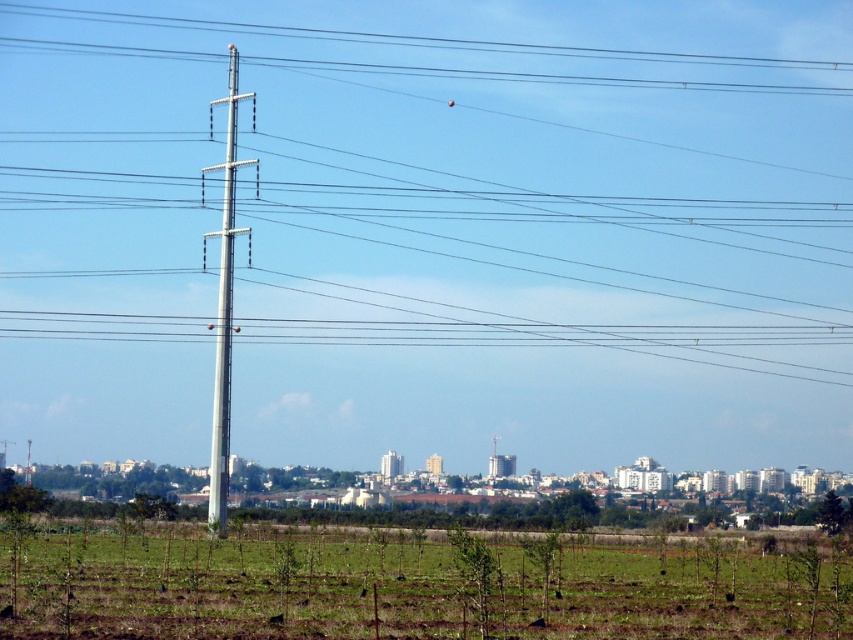
Which is behind, point (521, 620) or point (218, 486)?

Point (218, 486)

Does point (103, 534) lie behind point (219, 467)?

That is True.

Which is in front, point (726, 561) or point (227, 273)?

Positioned in front is point (726, 561).

Where is `green grassy field at lower center`? green grassy field at lower center is located at coordinates (415, 582).

Is metallic wire at center behind metallic gray telegraph pole at left?

Yes, it is.

Does metallic wire at center appear on the right side of metallic gray telegraph pole at left?

In fact, metallic wire at center is to the left of metallic gray telegraph pole at left.

This screenshot has width=853, height=640. Describe the element at coordinates (428, 212) in the screenshot. I see `metallic wire at center` at that location.

Locate an element on the screen. Image resolution: width=853 pixels, height=640 pixels. metallic wire at center is located at coordinates (428, 212).

Consider the image. Can you confirm if metallic wire at center is wider than green grassy field at lower center?

Yes.

Which is more to the right, metallic wire at center or green grassy field at lower center?

green grassy field at lower center is more to the right.

What are the coordinates of `metallic wire at center` in the screenshot? It's located at (428, 212).